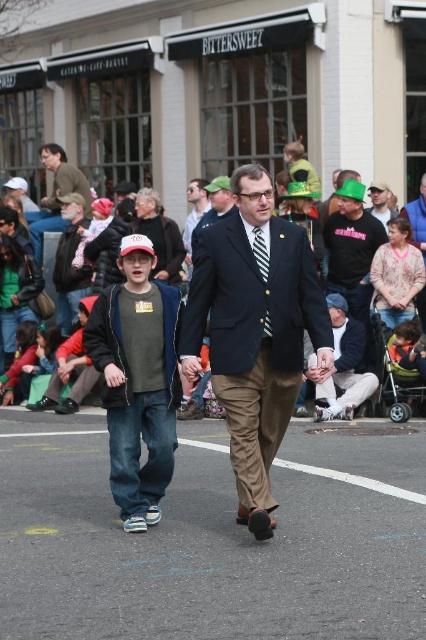
Question: Does matte gray hoodie at center appear on the left side of matte brown jacket at upper left?

Choices:
 (A) yes
 (B) no

Answer: (B)

Question: Which point is closer to the camera taking this photo?

Choices:
 (A) (74, 172)
 (B) (143, 189)
 (C) (37, 330)

Answer: (C)

Question: Which object appears farthest from the camera in this image?

Choices:
 (A) matte gray hoodie at center
 (B) black matte shirt at center
 (C) green felt hat at center

Answer: (C)

Question: Which point appears farthest from the camera in this image?

Choices:
 (A) pos(359,387)
 (B) pos(172,230)

Answer: (B)

Question: Does denim jeans at center have a larger size compared to khaki cotton pants at center?

Choices:
 (A) no
 (B) yes

Answer: (A)

Question: From the image, what is the correct spatial relationship of navy blue suit at center in relation to matte brown jacket at upper left?

Choices:
 (A) above
 (B) below

Answer: (B)